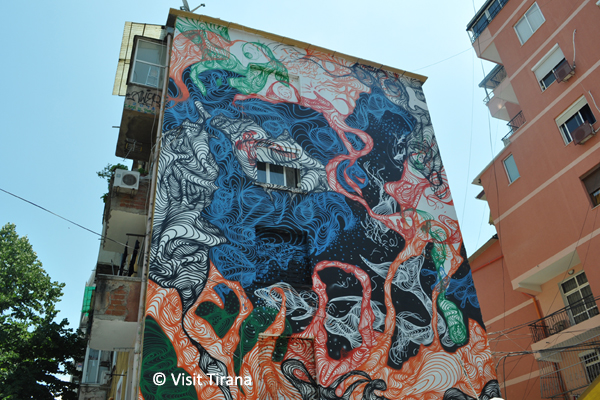
You are a GUI agent. You are given a task and a screenshot of the screen. Output one action in this format:
    pyautogui.click(x=<x>, y=<y>)
    Task: Click on the walls
    Image resolution: width=600 pixels, height=400 pixels.
    Given the screenshot: What is the action you would take?
    pyautogui.click(x=361, y=200), pyautogui.click(x=541, y=186), pyautogui.click(x=577, y=25), pyautogui.click(x=490, y=325)